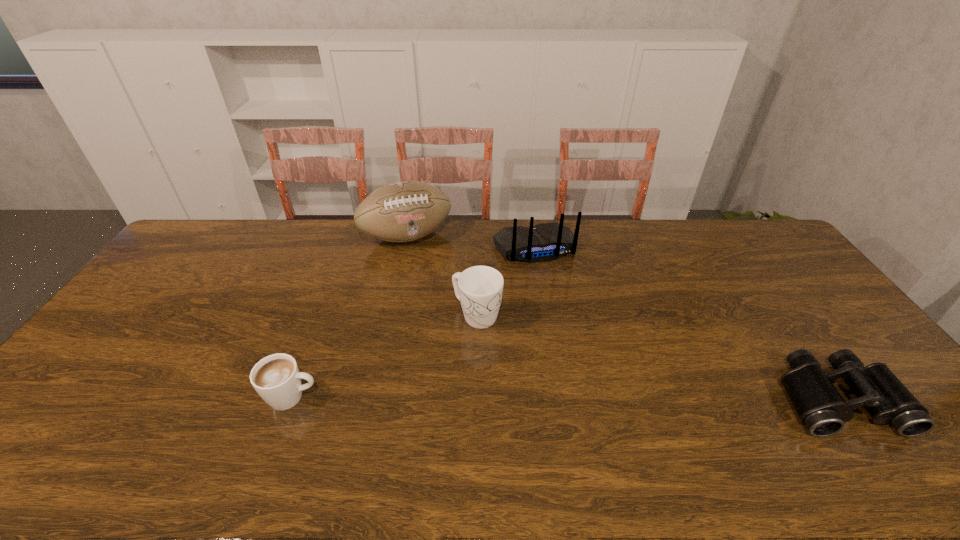
Locate an element on the screen. free spot on the desktop that is between the cappuccino and the rightmost object and is positioned on the back of the router is located at coordinates (602, 398).

Find the location of a particular element. The image size is (960, 540). free space on the desktop that is between the cappuccino and the rightmost object and is positioned on the side of the third tallest object with the handle is located at coordinates (602, 398).

This screenshot has width=960, height=540. I want to click on free space on the desktop that is between the cappuccino and the rightmost object and is positioned on the laces of the football (American), so click(492, 397).